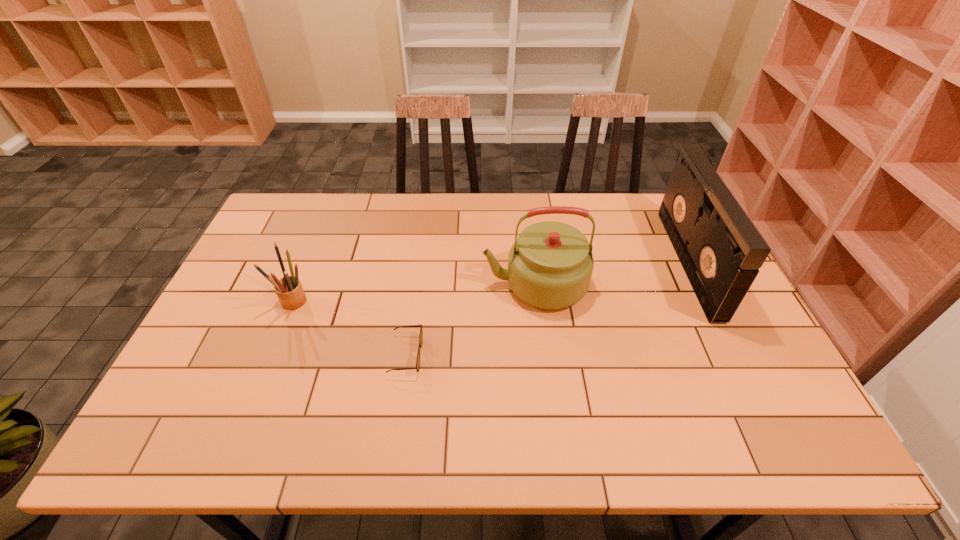
At what (x,y) coordinates should I click in order to perform the action: click on vacant region located 0.220m on the front side of the rightmost object. Please return your answer as a coordinate pair (x, y). Looking at the image, I should click on (609, 262).

Locate an element on the screen. This screenshot has height=540, width=960. vacant region located on the front side of the rightmost object is located at coordinates (619, 262).

Identify the location of blank area located on the right of the leftmost object. (395, 301).

Identify the location of free space located on the front-facing side of the sunglasses. (531, 355).

Image resolution: width=960 pixels, height=540 pixels. Find the location of `object situated at the far edge`. object situated at the far edge is located at coordinates (721, 251).

Where is `object at the left edge`? object at the left edge is located at coordinates pos(289,290).

Identify the location of object that is at the right edge. This screenshot has width=960, height=540. (721, 251).

This screenshot has height=540, width=960. What are the coordinates of `object situated at the far right corner` in the screenshot? It's located at (721, 251).

Where is `vacant region at the far edge`? Image resolution: width=960 pixels, height=540 pixels. vacant region at the far edge is located at coordinates (348, 195).

This screenshot has width=960, height=540. Find the location of `free space at the near edge of the desktop`. free space at the near edge of the desktop is located at coordinates (388, 450).